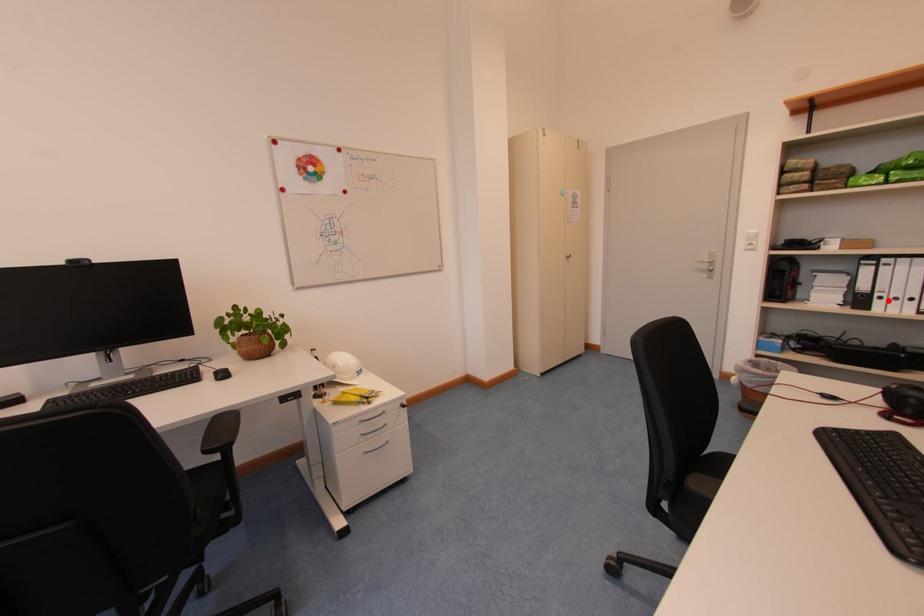
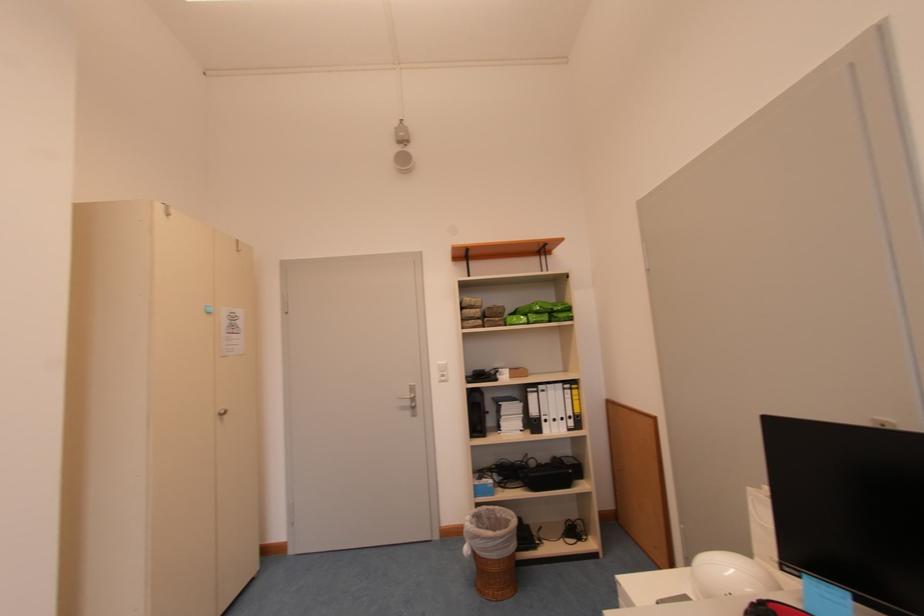
Question: A red point is marked in image1. In image2, is the corresponding 3D point closer to the camera or farther? Reply with the corresponding letter.

Choices:
 (A) The corresponding 3D point is closer.
 (B) The corresponding 3D point is farther.

Answer: (B)